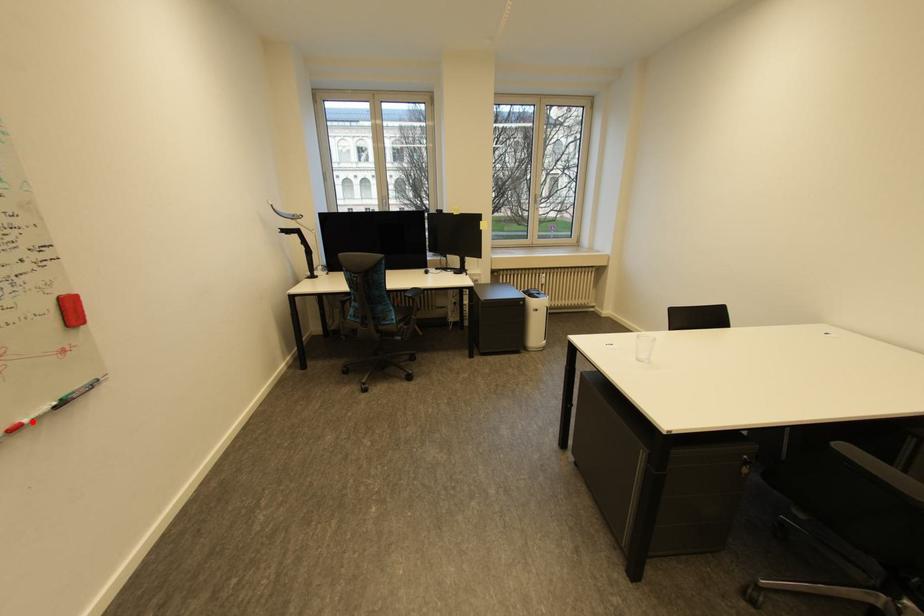
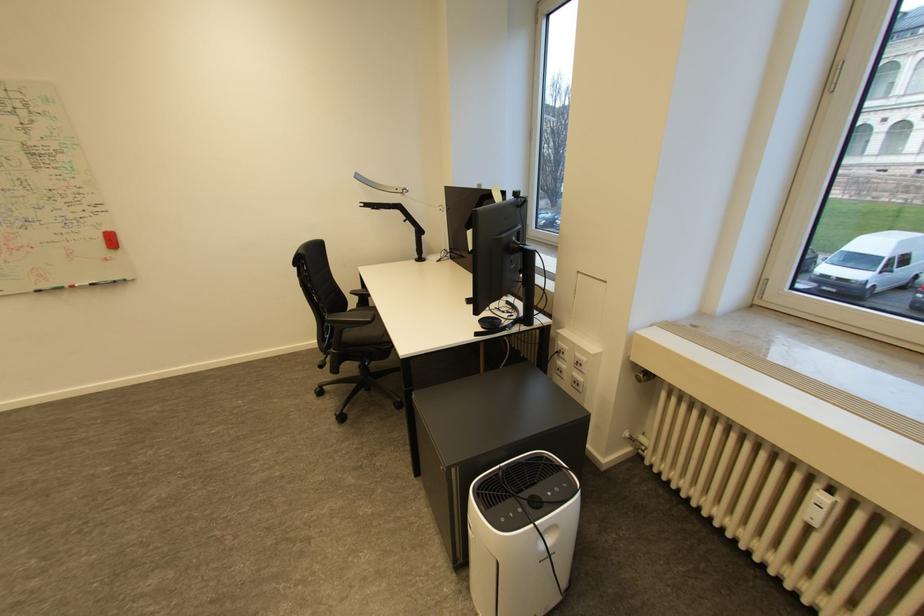
Locate, in the second image, the point that corresponds to the highlighted location in the first image.

(83, 286)